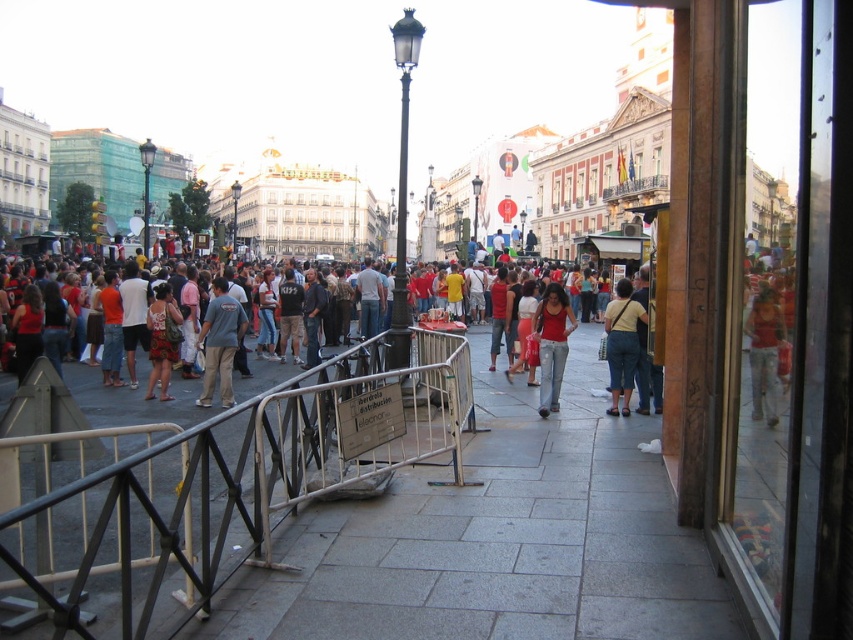
Question: Observing the image, what is the correct spatial positioning of silver metallic rail at center in reference to matte red shirt at center?

Choices:
 (A) left
 (B) right

Answer: (A)

Question: Which of the following is the closest to the observer?

Choices:
 (A) (556, 339)
 (B) (608, 348)
 (C) (583, 400)

Answer: (B)

Question: Is denim jeans at right positioned before blue cotton shirt at center?

Choices:
 (A) yes
 (B) no

Answer: (A)

Question: Based on their relative distances, which object is nearer to the silver metallic rail at center?

Choices:
 (A) matte red dress at center
 (B) blue cotton shirt at center

Answer: (B)

Question: Which object appears farthest from the camera in this image?

Choices:
 (A) yellow fabric shirt at center
 (B) gray concrete pavement at center

Answer: (A)

Question: From the image, what is the correct spatial relationship of gray concrete pavement at center in relation to denim jeans at right?

Choices:
 (A) right
 (B) left

Answer: (B)